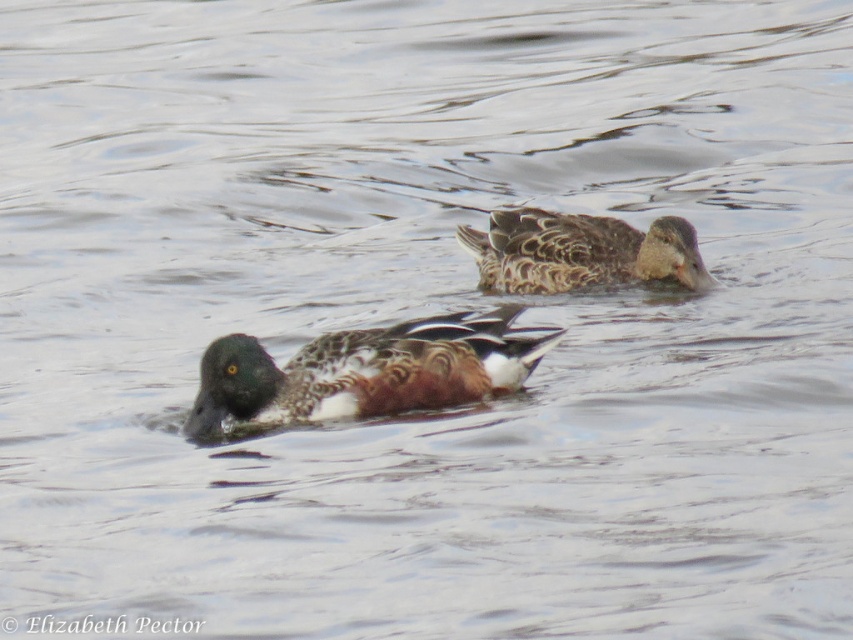
Question: Can you confirm if greenish-brown speckled duck at center is wider than brown speckled duck at upper center?

Choices:
 (A) no
 (B) yes

Answer: (B)

Question: Which point appears farthest from the camera in this image?

Choices:
 (A) (515, 340)
 (B) (479, 236)

Answer: (B)

Question: Which point appears farthest from the camera in this image?

Choices:
 (A) (312, 344)
 (B) (531, 227)

Answer: (B)

Question: Can you confirm if greenish-brown speckled duck at center is positioned to the left of brown speckled duck at upper center?

Choices:
 (A) no
 (B) yes

Answer: (B)

Question: Does greenish-brown speckled duck at center have a larger size compared to brown speckled duck at upper center?

Choices:
 (A) no
 (B) yes

Answer: (A)